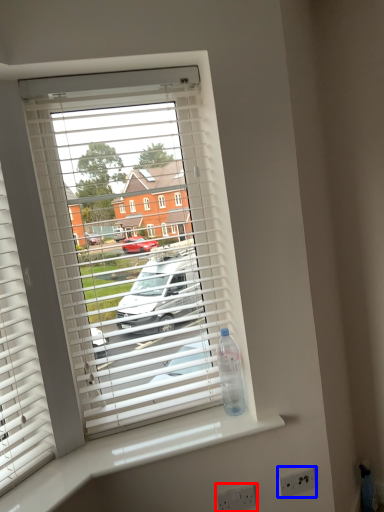
Question: Which object appears farthest to the camera in this image, electric outlet (highlighted by a red box) or electric outlet (highlighted by a blue box)?

Choices:
 (A) electric outlet
 (B) electric outlet

Answer: (B)